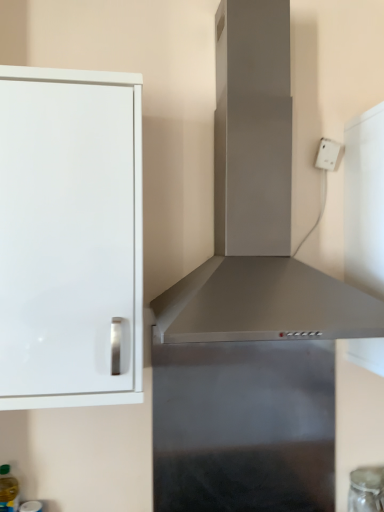
Question: In the image, is translucent plastic bottle at lower left positioned in front of or behind white glossy cabinet at left?

Choices:
 (A) front
 (B) behind

Answer: (B)

Question: Would you say translucent plastic bottle at lower left is to the left or to the right of white glossy cabinet at left in the picture?

Choices:
 (A) left
 (B) right

Answer: (A)

Question: Which of these objects is positioned closest to the translucent plastic bottle at lower left?

Choices:
 (A) white glossy cabinet at left
 (B) satin silver vent at center
 (C) transparent glass jar at lower right

Answer: (A)

Question: Which of these objects is positioned farthest from the white glossy cabinet at left?

Choices:
 (A) transparent glass jar at lower right
 (B) satin silver vent at center
 (C) translucent plastic bottle at lower left

Answer: (A)